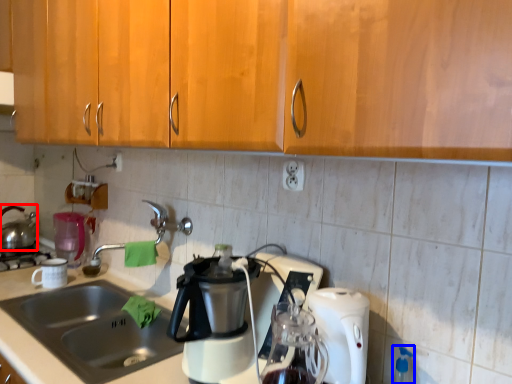
Question: Among these objects, which one is nearest to the camera, kettle (highlighted by a red box) or bottle (highlighted by a blue box)?

Choices:
 (A) kettle
 (B) bottle

Answer: (B)